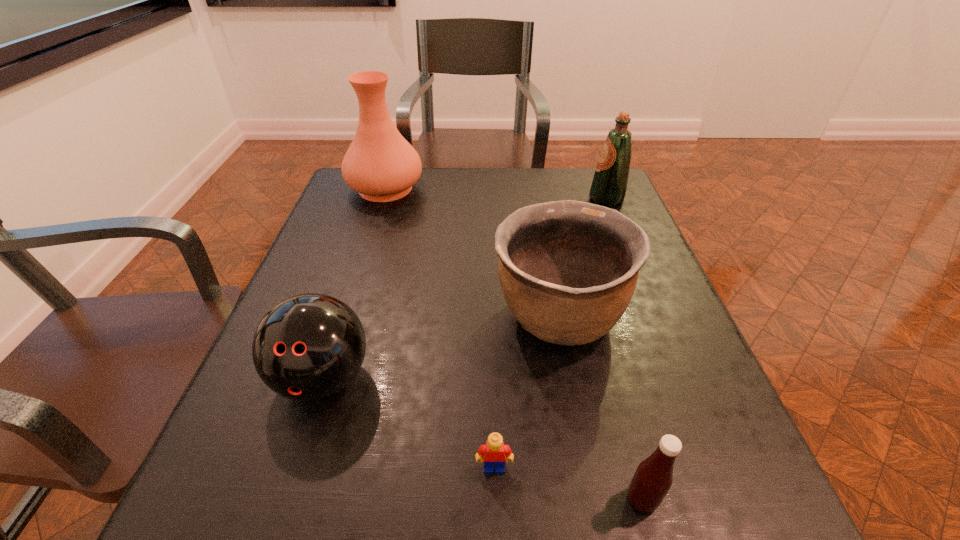
Where is `free space between the vase and the pottery`? The height and width of the screenshot is (540, 960). free space between the vase and the pottery is located at coordinates (472, 253).

Find the location of `vacant point located between the bowling ball and the Lego`. vacant point located between the bowling ball and the Lego is located at coordinates (409, 423).

Choose which object is the third nearest neighbor to the nearest object. Please provide its 2D coordinates. Your answer should be formatted as a tuple, i.e. [(x, y)], where the tuple contains the x and y coordinates of a point satisfying the conditions above.

[(308, 347)]

Locate which object ranks in proximity to the nearest object. Please provide its 2D coordinates. Your answer should be formatted as a tuple, i.e. [(x, y)], where the tuple contains the x and y coordinates of a point satisfying the conditions above.

[(494, 452)]

Find the location of a particular element. This screenshot has height=540, width=960. free region that satisfies the following two spatial constraints: 1. on the front-facing side of the fifth shortest object; 2. on the front side of the pottery is located at coordinates (655, 317).

Where is `vacant position in the image that satisfies the following two spatial constraints: 1. on the face of the Lego; 2. on the right side of the nearest object`? This screenshot has width=960, height=540. vacant position in the image that satisfies the following two spatial constraints: 1. on the face of the Lego; 2. on the right side of the nearest object is located at coordinates (495, 500).

Identify the location of free space that satisfies the following two spatial constraints: 1. on the front side of the Tabasco sauce; 2. on the right side of the pottery. The image size is (960, 540). click(x=592, y=500).

What are the coordinates of `free point that satisfies the following two spatial constraints: 1. on the front-facing side of the fifth shortest object; 2. on the face of the Lego` in the screenshot? It's located at (717, 468).

At what (x,y) coordinates should I click in order to perform the action: click on free space that satisfies the following two spatial constraints: 1. on the front-facing side of the second tallest object; 2. on the surface of the bowling ball near the finger holes. Please return your answer as a coordinate pair (x, y). This screenshot has width=960, height=540. Looking at the image, I should click on (681, 379).

What are the coordinates of `free space that satisfies the following two spatial constraints: 1. on the front side of the vase; 2. on the right side of the pottery` in the screenshot? It's located at (345, 317).